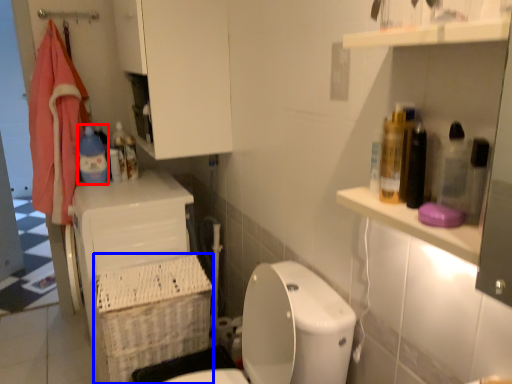
Question: Which of the following is the closest to the observer, cleaning product (highlighted by a red box) or basket (highlighted by a blue box)?

Choices:
 (A) cleaning product
 (B) basket

Answer: (B)